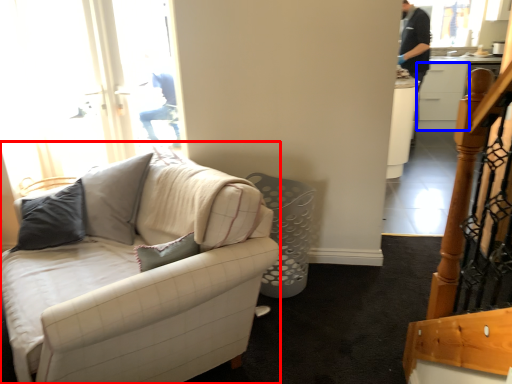
Question: Among these objects, which one is nearest to the camera, studio couch (highlighted by a red box) or cabinetry (highlighted by a blue box)?

Choices:
 (A) studio couch
 (B) cabinetry

Answer: (A)